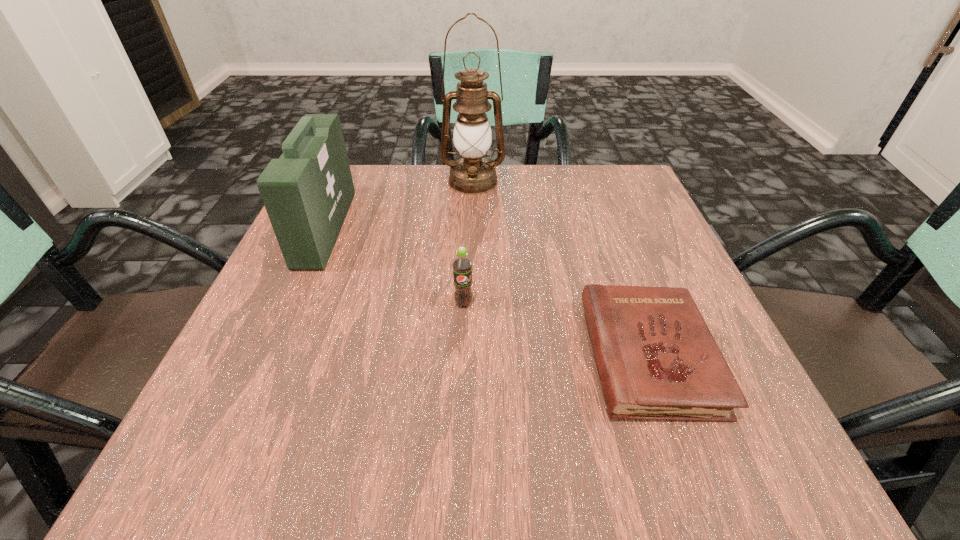
Locate an element on the screen. vacant point located between the hardback book and the tallest object is located at coordinates (562, 269).

The image size is (960, 540). What are the coordinates of `vacant area that lies between the leftmost object and the soda` in the screenshot? It's located at [395, 266].

Identify the location of vacant region between the oil lamp and the leftmost object. The image size is (960, 540). (399, 205).

The height and width of the screenshot is (540, 960). What are the coordinates of `free spot between the oil lamp and the first-aid kit` in the screenshot? It's located at (399, 205).

Select which object appears as the closest to the first-aid kit. Please provide its 2D coordinates. Your answer should be formatted as a tuple, i.e. [(x, y)], where the tuple contains the x and y coordinates of a point satisfying the conditions above.

[(472, 174)]

Select which object is the second closest to the tallest object. Please provide its 2D coordinates. Your answer should be formatted as a tuple, i.e. [(x, y)], where the tuple contains the x and y coordinates of a point satisfying the conditions above.

[(462, 266)]

Locate an element on the screen. Image resolution: width=960 pixels, height=540 pixels. vacant point that satisfies the following two spatial constraints: 1. on the front-facing side of the second tallest object; 2. on the right side of the rightmost object is located at coordinates pyautogui.click(x=270, y=356).

I want to click on vacant point that satisfies the following two spatial constraints: 1. on the front-facing side of the third shortest object; 2. on the left side of the rightmost object, so click(x=270, y=356).

Where is `vacant position in the image that satisfies the following two spatial constraints: 1. on the front-facing side of the rightmost object; 2. on the right side of the third shortest object`? The height and width of the screenshot is (540, 960). vacant position in the image that satisfies the following two spatial constraints: 1. on the front-facing side of the rightmost object; 2. on the right side of the third shortest object is located at coordinates (270, 356).

This screenshot has height=540, width=960. Identify the location of vacant position in the image that satisfies the following two spatial constraints: 1. on the front-facing side of the hardback book; 2. on the right side of the first-aid kit. (270, 356).